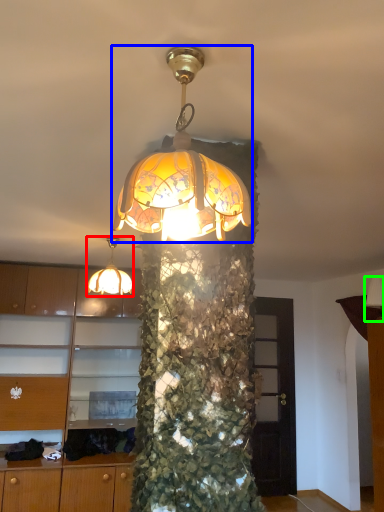
Question: Considering the real-world distances, which object is farthest from lamp (highlighted by a red box)? lamp (highlighted by a blue box) or lamp (highlighted by a green box)?

Choices:
 (A) lamp
 (B) lamp

Answer: (B)